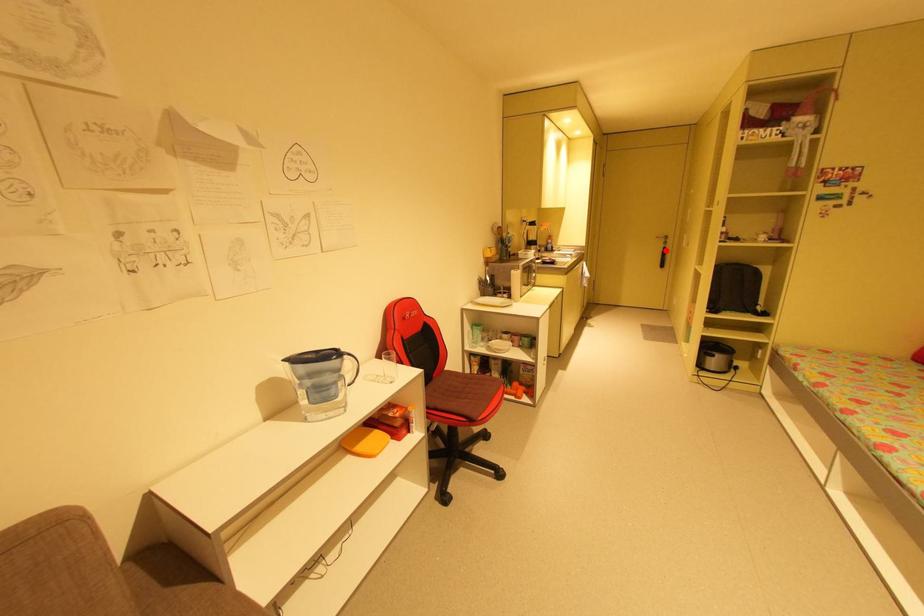
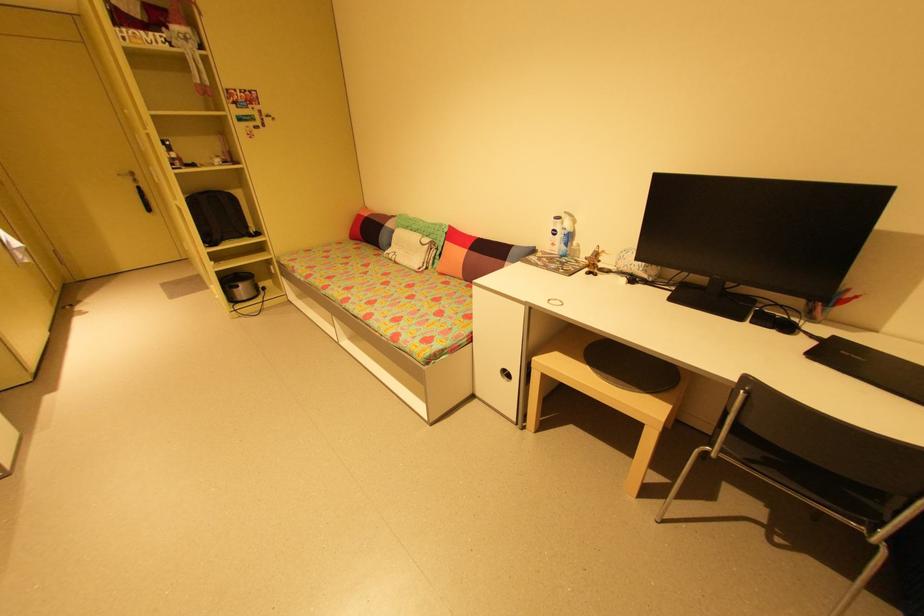
Question: A red point is marked in image1. In image2, is the corresponding 3D point closer to the camera or farther? Reply with the corresponding letter.

Choices:
 (A) The corresponding 3D point is closer.
 (B) The corresponding 3D point is farther.

Answer: (B)